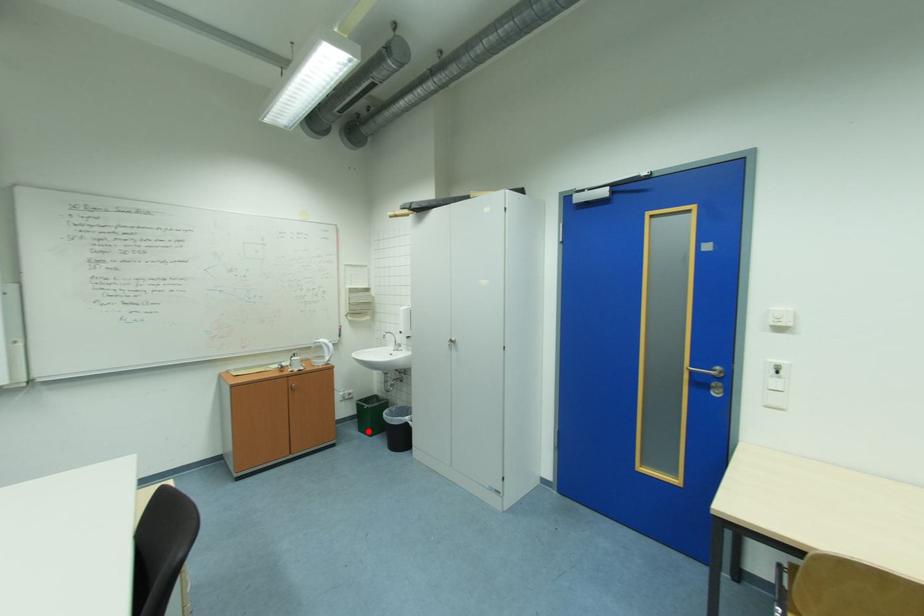
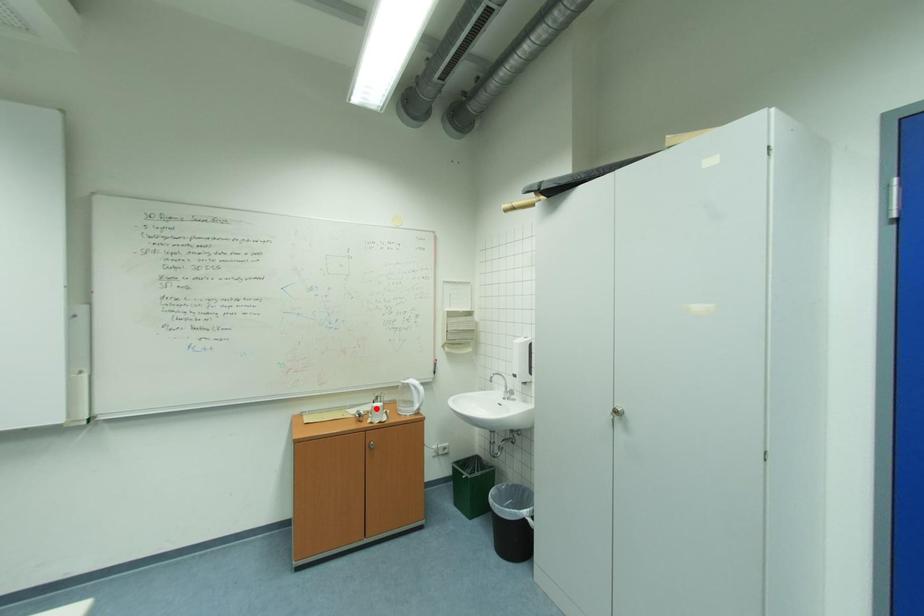
I am providing you with two images of the same scene from different viewpoints. A red point is marked on the first image and another point is marked on the second image. Do the highlighted points in image1 and image2 indicate the same real-world spot?

No